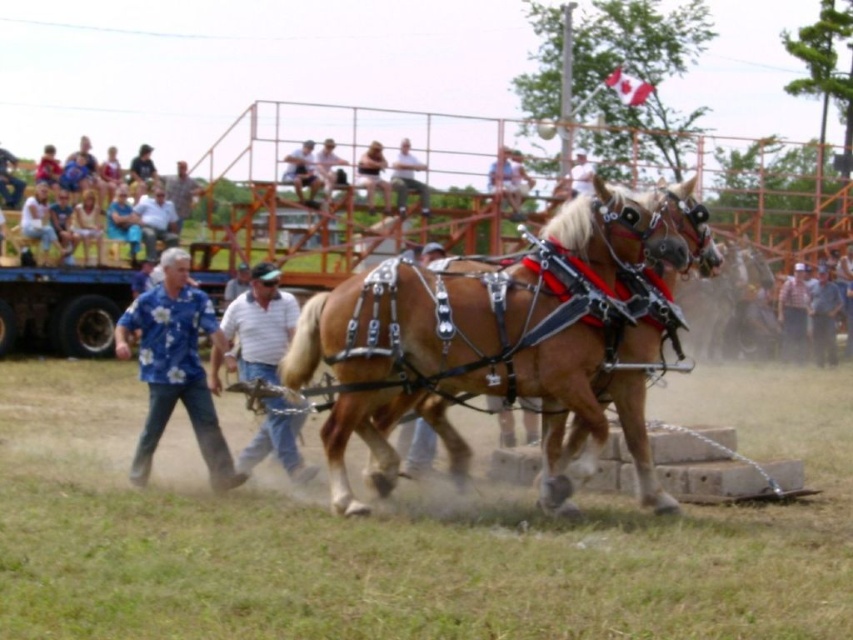
Question: Is the position of blue floral shirt at left less distant than that of light brown leather jacket at center?

Choices:
 (A) yes
 (B) no

Answer: (A)

Question: Can you confirm if blue floral shirt at left is thinner than light blue shirt at upper center?

Choices:
 (A) no
 (B) yes

Answer: (A)

Question: Which object appears farthest from the camera in this image?

Choices:
 (A) light brown leather jacket at center
 (B) light blue shirt at upper center

Answer: (B)

Question: Which of the following is the farthest from the observer?

Choices:
 (A) blue floral shirt at center
 (B) blue floral shirt at left
 (C) light blue shirt at upper center
 (D) blue floral shirt at upper left

Answer: (C)

Question: Which of the following is the farthest from the observer?

Choices:
 (A) (93, 230)
 (B) (270, 328)
 (C) (407, 161)
 (D) (306, 374)

Answer: (C)

Question: Is brown leather harness at center positioned in front of blue floral shirt at upper left?

Choices:
 (A) no
 (B) yes

Answer: (B)